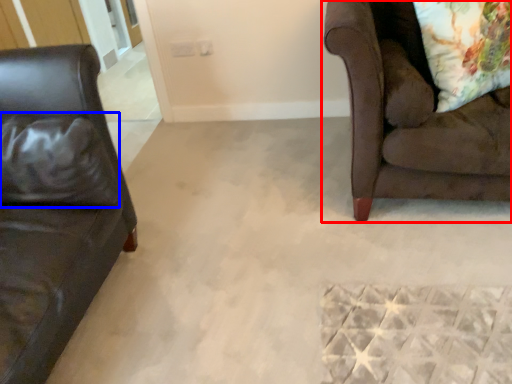
Question: Which point is closer to the camera, studio couch (highlighted by a red box) or pillow (highlighted by a blue box)?

Choices:
 (A) studio couch
 (B) pillow

Answer: (A)